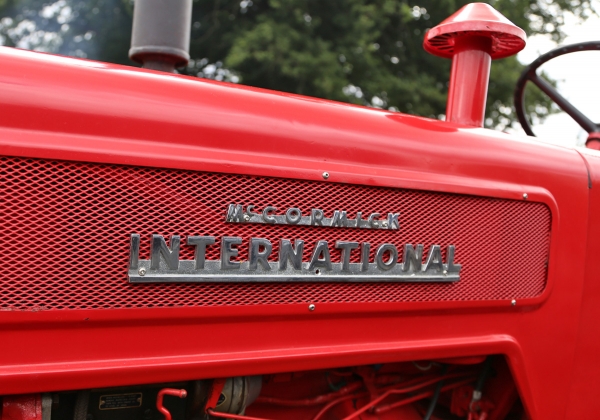
Where is `grate`? Image resolution: width=600 pixels, height=420 pixels. grate is located at coordinates (118, 210).